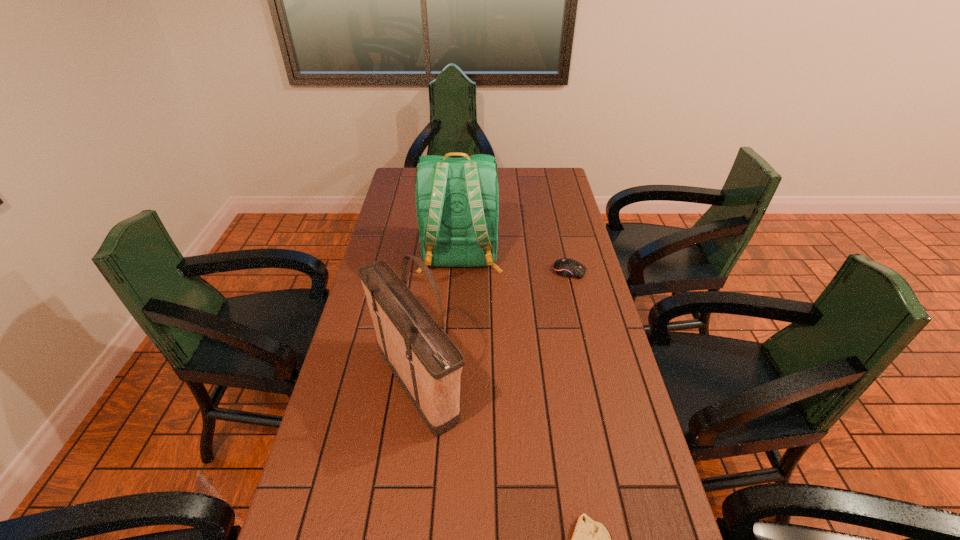
The width and height of the screenshot is (960, 540). In order to click on free space at the far right corner of the desktop in this screenshot , I will do `click(550, 168)`.

This screenshot has height=540, width=960. Identify the location of free spot between the shopping bag and the third tallest object. (493, 329).

Where is `vacant space that's between the backpack and the third farthest object`? This screenshot has width=960, height=540. vacant space that's between the backpack and the third farthest object is located at coordinates (439, 321).

Find the location of a particular element. free point between the shopping bag and the second shortest object is located at coordinates (493, 329).

Locate an element on the screen. The height and width of the screenshot is (540, 960). free area in between the backpack and the third farthest object is located at coordinates (439, 321).

The width and height of the screenshot is (960, 540). Identify the location of free space between the computer mouse and the shopping bag. (493, 329).

In order to click on vacant area that lies between the backpack and the shopping bag in this screenshot , I will do `click(439, 321)`.

Image resolution: width=960 pixels, height=540 pixels. What are the coordinates of `free space between the shopping bag and the backpack` in the screenshot? It's located at (439, 321).

Where is `free point between the backpack and the shopping bag`? The width and height of the screenshot is (960, 540). free point between the backpack and the shopping bag is located at coordinates (439, 321).

Choose which object is the nearest neighbor to the second nearest object. Please provide its 2D coordinates. Your answer should be formatted as a tuple, i.e. [(x, y)], where the tuple contains the x and y coordinates of a point satisfying the conditions above.

[(457, 199)]